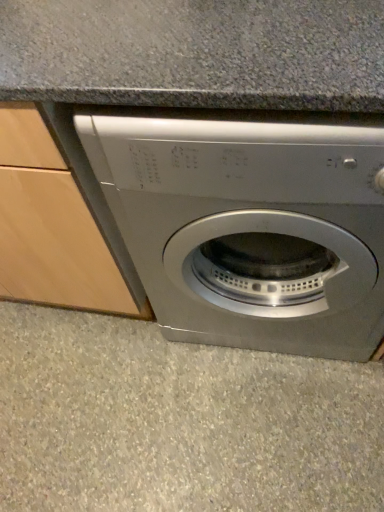
Image resolution: width=384 pixels, height=512 pixels. What are the coordinates of `satin silver washing machine at center` in the screenshot? It's located at (250, 228).

What do you see at coordinates (250, 228) in the screenshot? This screenshot has width=384, height=512. I see `satin silver washing machine at center` at bounding box center [250, 228].

This screenshot has height=512, width=384. Describe the element at coordinates (178, 421) in the screenshot. I see `gray speckled concrete at lower center` at that location.

This screenshot has height=512, width=384. Identify the location of gray speckled concrete at lower center. (178, 421).

Find the location of a particular element. The height and width of the screenshot is (512, 384). satin silver washing machine at center is located at coordinates (250, 228).

Which object is positioned more to the left, gray speckled concrete at lower center or satin silver washing machine at center?

Positioned to the left is gray speckled concrete at lower center.

Which is in front, gray speckled concrete at lower center or satin silver washing machine at center?

satin silver washing machine at center is in front.

Which is closer, (43,374) or (184,252)?

Point (43,374) is positioned farther from the camera compared to point (184,252).

From the image's perspective, is gray speckled concrete at lower center under satin silver washing machine at center?

Yes, from the image's perspective, gray speckled concrete at lower center is beneath satin silver washing machine at center.

From a real-world perspective, is gray speckled concrete at lower center under satin silver washing machine at center?

Yes, from a real-world perspective, gray speckled concrete at lower center is below satin silver washing machine at center.

Considering the sizes of objects gray speckled concrete at lower center and satin silver washing machine at center in the image provided, who is thinner, gray speckled concrete at lower center or satin silver washing machine at center?

Thinner between the two is gray speckled concrete at lower center.

Does gray speckled concrete at lower center have a lesser height compared to satin silver washing machine at center?

Yes, gray speckled concrete at lower center is shorter than satin silver washing machine at center.

From the picture: Can you confirm if gray speckled concrete at lower center is smaller than satin silver washing machine at center?

Indeed, gray speckled concrete at lower center has a smaller size compared to satin silver washing machine at center.

Is gray speckled concrete at lower center inside or outside of satin silver washing machine at center?

gray speckled concrete at lower center exists outside the volume of satin silver washing machine at center.

Are gray speckled concrete at lower center and satin silver washing machine at center beside each other?

gray speckled concrete at lower center and satin silver washing machine at center are not in contact.

Is gray speckled concrete at lower center facing away from satin silver washing machine at center?

Yes, gray speckled concrete at lower center's orientation is away from satin silver washing machine at center.

Can you tell me how much gray speckled concrete at lower center and satin silver washing machine at center differ in facing direction?

The angle between the facing direction of gray speckled concrete at lower center and the facing direction of satin silver washing machine at center is 0.000267 degrees.

Looking at this image, how much distance is there between gray speckled concrete at lower center and satin silver washing machine at center?

They are 15.03 inches apart.

At what (x,y) coordinates should I click in order to perform the action: click on washing machine that is above the gray speckled concrete at lower center (from the image's perspective). Please return your answer as a coordinate pair (x, y). The width and height of the screenshot is (384, 512). Looking at the image, I should click on (250, 228).

Is satin silver washing machine at center to the left or to the right of gray speckled concrete at lower center in the image?

Clearly, satin silver washing machine at center is on the right of gray speckled concrete at lower center in the image.

Looking at this image, is satin silver washing machine at center closer to the viewer compared to gray speckled concrete at lower center?

Yes, the depth of satin silver washing machine at center is less than that of gray speckled concrete at lower center.

Which is less distant, [247,237] or [269,438]?

Point [247,237] is farther from the camera than point [269,438].

From the image's perspective, which is above, satin silver washing machine at center or gray speckled concrete at lower center?

satin silver washing machine at center appears higher in the image.

From a real-world perspective, is satin silver washing machine at center positioned above or below gray speckled concrete at lower center?

satin silver washing machine at center is situated higher than gray speckled concrete at lower center in the real world.

Looking at this image, which of these two, satin silver washing machine at center or gray speckled concrete at lower center, is wider?

With larger width is satin silver washing machine at center.

Does satin silver washing machine at center have a lesser height compared to gray speckled concrete at lower center?

In fact, satin silver washing machine at center may be taller than gray speckled concrete at lower center.

Which of these two, satin silver washing machine at center or gray speckled concrete at lower center, is smaller?

gray speckled concrete at lower center is smaller.

Is satin silver washing machine at center spatially inside gray speckled concrete at lower center, or outside of it?

satin silver washing machine at center is spatially situated outside gray speckled concrete at lower center.

Is satin silver washing machine at center next to gray speckled concrete at lower center?

No, satin silver washing machine at center is not with gray speckled concrete at lower center.

Is satin silver washing machine at center positioned with its back to gray speckled concrete at lower center?

satin silver washing machine at center is not turned away from gray speckled concrete at lower center.

Measure the distance between satin silver washing machine at center and gray speckled concrete at lower center.

They are 15.03 inches apart.

Find the location of a particular element. This screenshot has height=512, width=384. concrete behind the satin silver washing machine at center is located at coordinates (178, 421).

The height and width of the screenshot is (512, 384). In order to click on concrete below the satin silver washing machine at center (from a real-world perspective) in this screenshot , I will do `click(178, 421)`.

Find the location of a particular element. Image resolution: width=384 pixels, height=512 pixels. concrete to the left of satin silver washing machine at center is located at coordinates (178, 421).